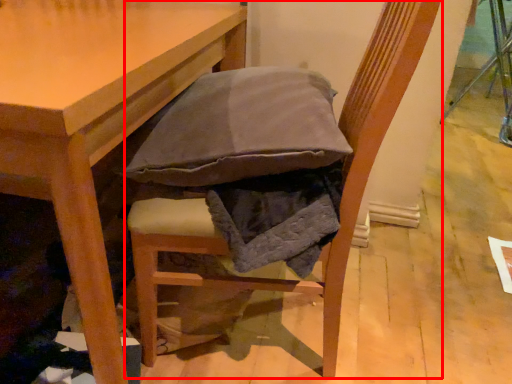
Question: Considering the relative positions of chair (annotated by the red box) and table in the image provided, where is chair (annotated by the red box) located with respect to the staircase?

Choices:
 (A) right
 (B) left

Answer: (A)